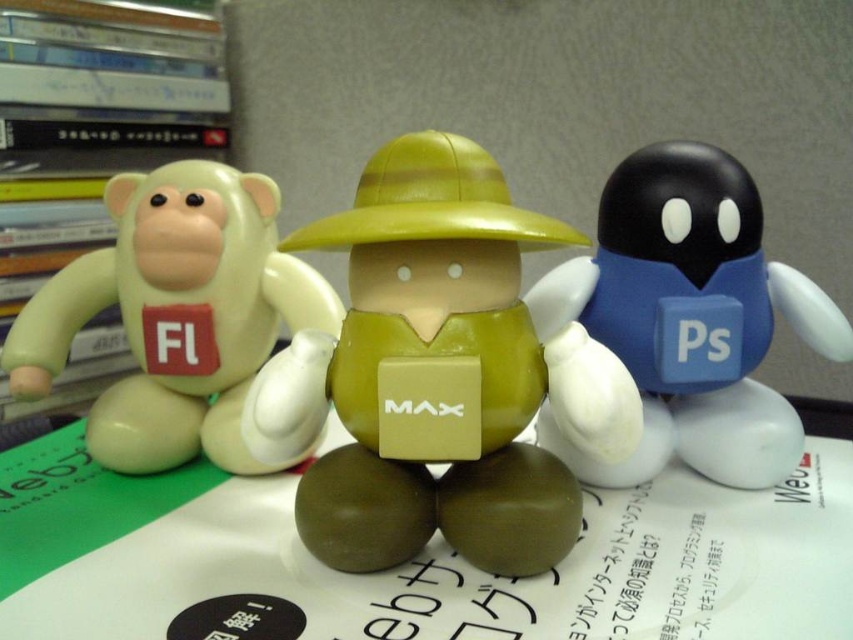
Question: Does matte green figure at center appear over matte green plastic monkey at left?

Choices:
 (A) yes
 (B) no

Answer: (B)

Question: Among these points, which one is farthest from the camera?

Choices:
 (A) (138, 356)
 (B) (688, 452)
 (C) (364, 307)

Answer: (A)

Question: Which of the following is the closest to the observer?

Choices:
 (A) blue matte/soft toy at right
 (B) matte green plastic monkey at left
 (C) matte green figure at center

Answer: (C)

Question: Observing the image, what is the correct spatial positioning of matte green figure at center in reference to matte green plastic monkey at left?

Choices:
 (A) above
 (B) below

Answer: (B)

Question: Which point is farther to the camera?

Choices:
 (A) pyautogui.click(x=140, y=225)
 (B) pyautogui.click(x=454, y=323)

Answer: (A)

Question: Can you confirm if matte green figure at center is thinner than blue matte/soft toy at right?

Choices:
 (A) yes
 (B) no

Answer: (A)